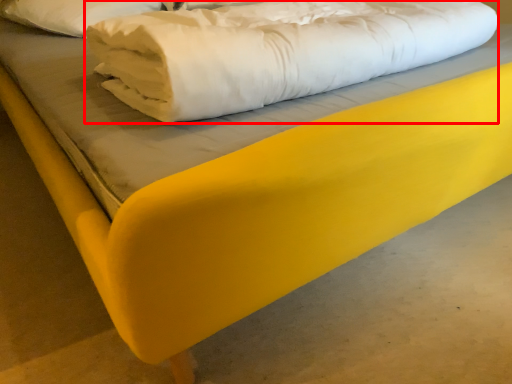
Question: Observing the image, what is the correct spatial positioning of sheet (annotated by the red box) in reference to pillow?

Choices:
 (A) right
 (B) left

Answer: (A)